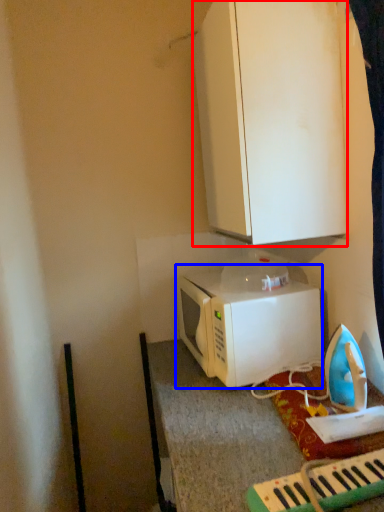
Question: Among these objects, which one is farthest to the camera, cabinetry (highlighted by a red box) or microwave oven (highlighted by a blue box)?

Choices:
 (A) cabinetry
 (B) microwave oven

Answer: (B)